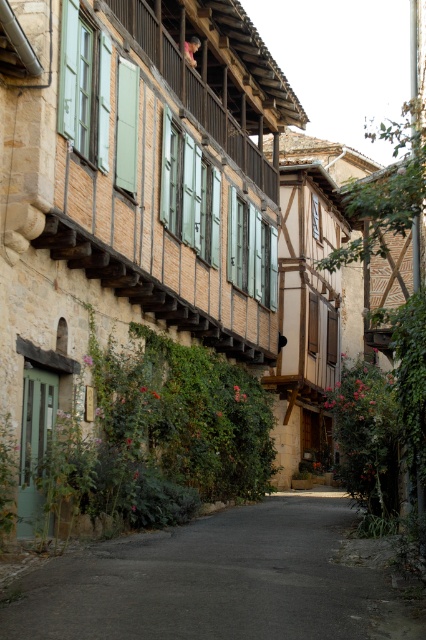
You are a delivery person driving a van that is 1.8 meters wide. You need to navigate through the narrow street shown in the image. Can your van safely pass through the section where the dark asphalt road at center and the green wooden balcony at upper center are located?

The dark asphalt road at center is wider than the green wooden balcony at upper center, so the van can safely pass through the section as the road is wide enough for the van.

You are standing at the entrance of the village and want to reach the center of the street. According to the map, the dark asphalt road at center is located at coordinates point 0.909, 0.512. Can you confirm if this point is the exact center of the road?

The dark asphalt road at center is indeed located at point (218,580), so yes, this coordinate marks the exact center of the road.